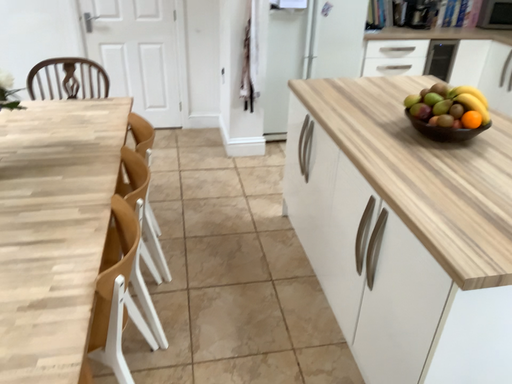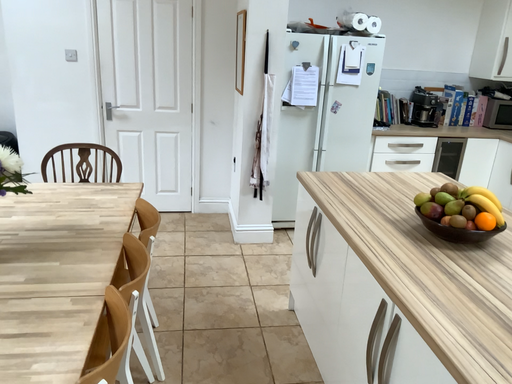
Question: How did the camera likely rotate when shooting the video?

Choices:
 (A) rotated upward
 (B) rotated downward

Answer: (A)